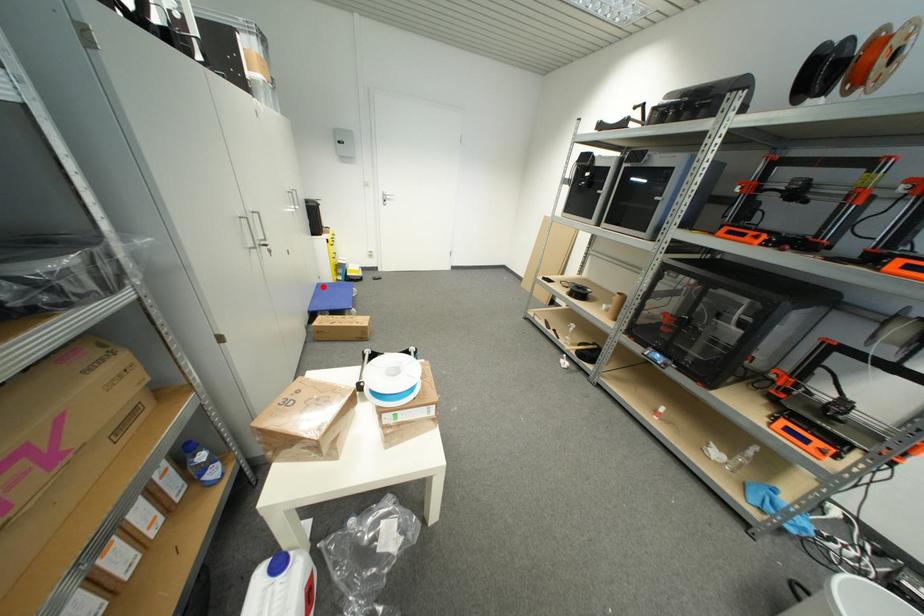
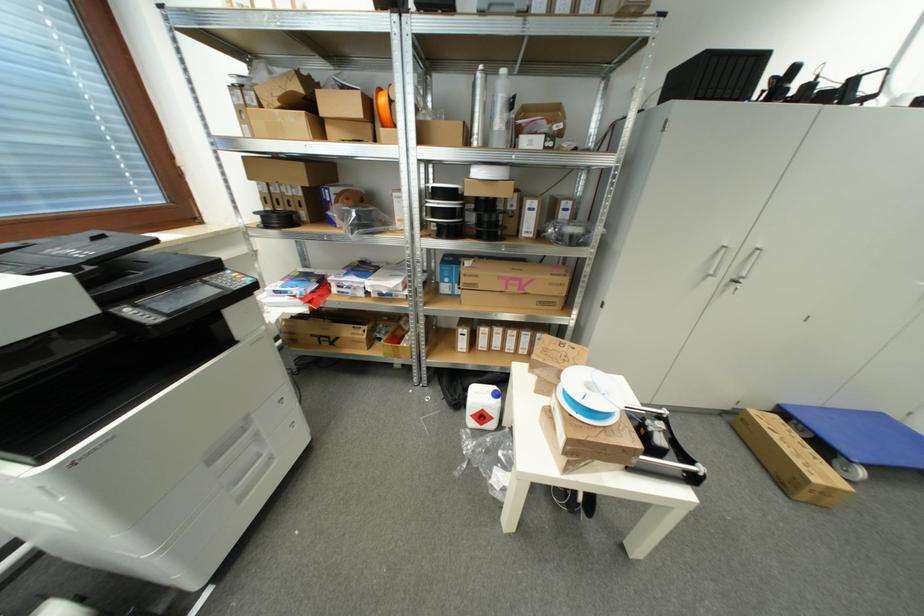
Question: I am providing you with two images of the same scene from different viewpoints. Image1 has a red point marked. In image2, the corresponding 3D location appears at what relative position? Reply with the corresponding letter.

Choices:
 (A) Closer
 (B) Farther

Answer: (B)